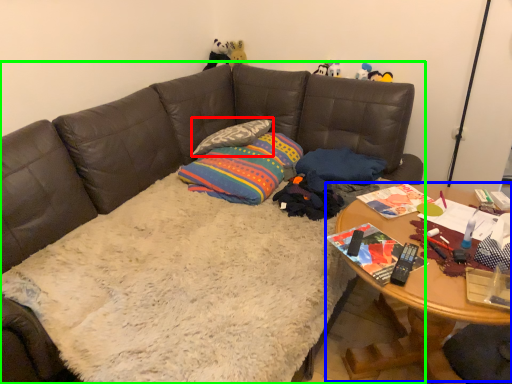
Question: Based on their relative distances, which object is farther from pillow (highlighted by a red box)? Choose from table (highlighted by a blue box) and studio couch (highlighted by a green box).

Choices:
 (A) table
 (B) studio couch

Answer: (A)